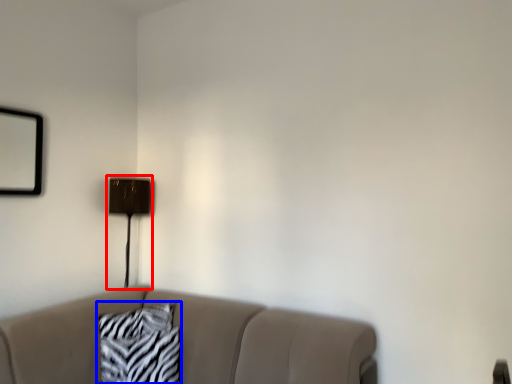
Question: Which object is closer to the camera taking this photo, table lamp (highlighted by a red box) or pillow (highlighted by a blue box)?

Choices:
 (A) table lamp
 (B) pillow

Answer: (B)